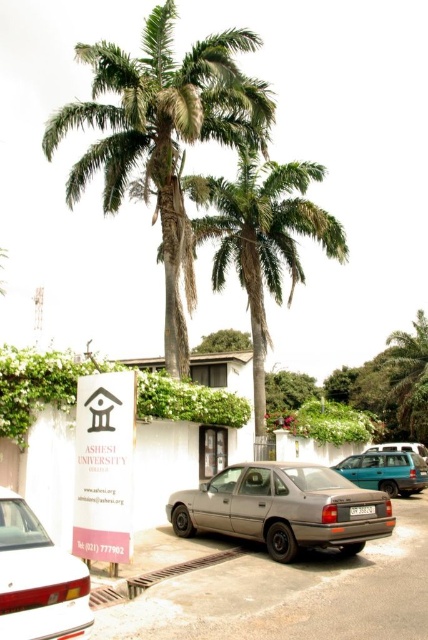
Who is higher up, green leafy palm tree at center or satin silver suv at center?

green leafy palm tree at center

I want to click on green leafy palm tree at center, so point(262,241).

Find the location of a particular element. green leafy palm tree at center is located at coordinates (262, 241).

Consider the image. Does green leafy palm tree at center appear on the right side of teal matte station wagon at center?

No, green leafy palm tree at center is not to the right of teal matte station wagon at center.

Measure the distance between green leafy palm tree at center and camera.

green leafy palm tree at center is 16.45 meters away from camera.

Identify the location of green leafy palm tree at center. The width and height of the screenshot is (428, 640). (262, 241).

Looking at this image, which is more to the right, satin silver sedan at center or satin silver suv at center?

satin silver suv at center is more to the right.

Who is positioned more to the left, satin silver sedan at center or satin silver suv at center?

From the viewer's perspective, satin silver sedan at center appears more on the left side.

You are a GUI agent. You are given a task and a screenshot of the screen. Output one action in this format:
    pyautogui.click(x=<x>, y=<y>)
    Task: Click on the satin silver sedan at center
    Image resolution: width=428 pixels, height=640 pixels.
    Given the screenshot: What is the action you would take?
    pyautogui.click(x=282, y=508)

The image size is (428, 640). I want to click on satin silver sedan at center, so pos(282,508).